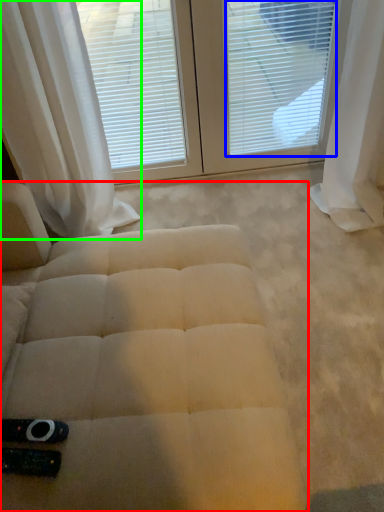
Question: Which is nearer to the furniture (highlighted by a red box)? blind (highlighted by a blue box) or curtain (highlighted by a green box).

Choices:
 (A) blind
 (B) curtain

Answer: (B)